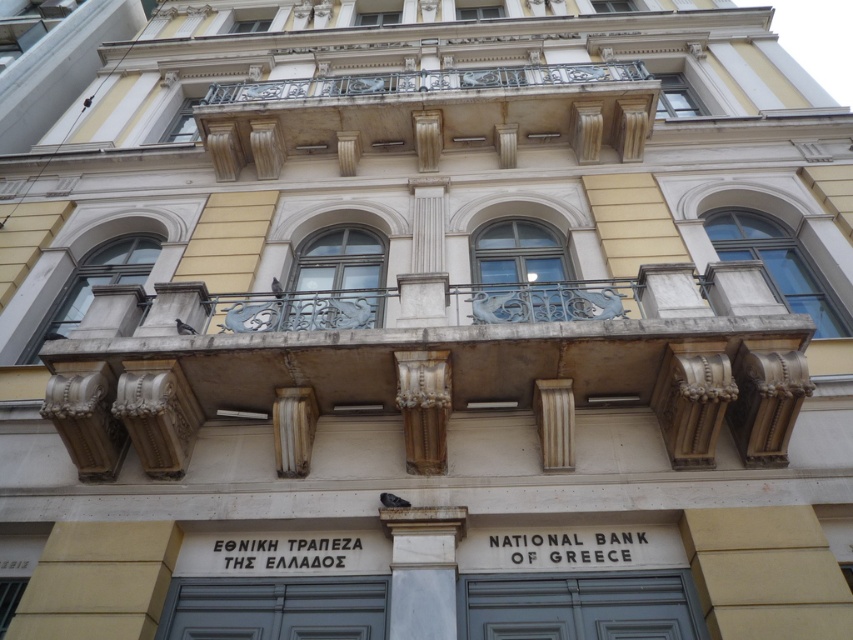
You are standing in front of the National Bank of Greece building. You notice two points marked on the building facade at coordinates point (349, 352) and point (431, 83). Which point is closer to you?

Point (349, 352) is in front of point (431, 83), so it is closer to you.

You are an architect analyzing the National Bank of Greece building. You notice the stone balustrade at center and the white marble column at center. Which architectural element is taller?

The stone balustrade at center is much taller than the white marble column at center.